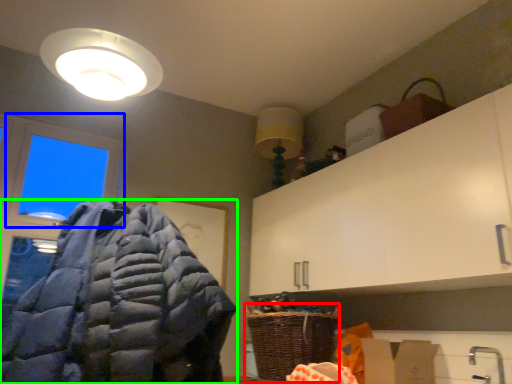
Question: Which object is the closest to the basket (highlighted by a red box)? Choose among these: window (highlighted by a blue box) or jacket (highlighted by a green box).

Choices:
 (A) window
 (B) jacket

Answer: (B)